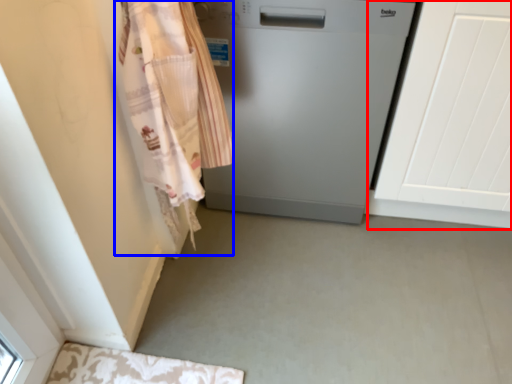
Question: Which object is further to the camera taking this photo, screen door (highlighted by a red box) or clothing (highlighted by a blue box)?

Choices:
 (A) screen door
 (B) clothing

Answer: (A)